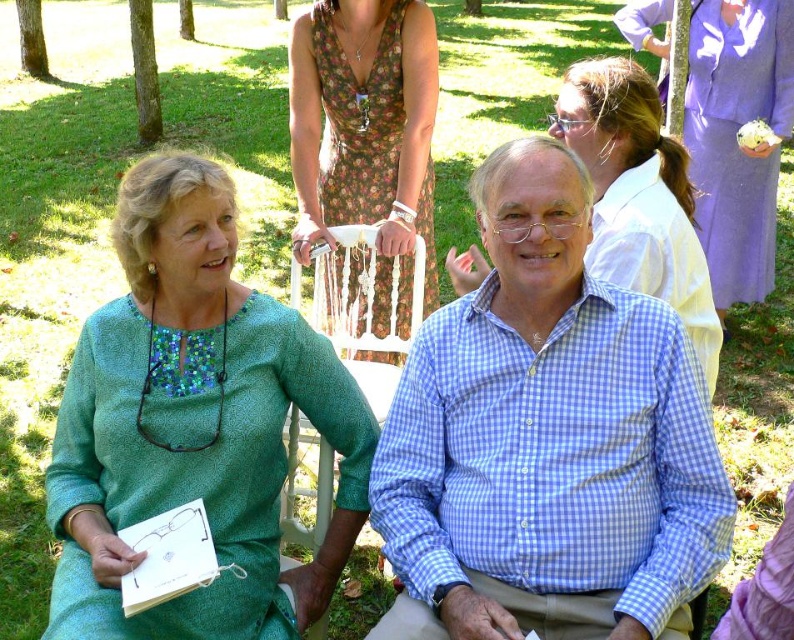
Is floral dress at center bigger than matte green dress at center?

Indeed, floral dress at center has a larger size compared to matte green dress at center.

Looking at this image, does floral dress at center lie behind matte green dress at center?

Yes, floral dress at center is further from the viewer.

Is point (384, 253) positioned after point (627, 99)?

Yes, it is behind point (627, 99).

Where is `floral dress at center`? The image size is (794, 640). floral dress at center is located at coordinates (365, 134).

Between point (444, 312) and point (87, 513), which one is positioned behind?

Point (444, 312)

Is blue checkered shirt at center to the right of green textured dress at left from the viewer's perspective?

Correct, you'll find blue checkered shirt at center to the right of green textured dress at left.

Between point (446, 568) and point (345, 472), which one is positioned in front?

Positioned in front is point (446, 568).

At what (x,y) coordinates should I click in order to perform the action: click on blue checkered shirt at center. Please return your answer as a coordinate pair (x, y). Looking at the image, I should click on (546, 435).

Does lavender satin dress at upper right appear on the left side of matte green dress at center?

In fact, lavender satin dress at upper right is to the right of matte green dress at center.

How distant is lavender satin dress at upper right from matte green dress at center?

lavender satin dress at upper right and matte green dress at center are 6.80 feet apart.

Between point (737, 172) and point (660, 196), which one is positioned in front?

Point (660, 196) is more forward.

You are a GUI agent. You are given a task and a screenshot of the screen. Output one action in this format:
    pyautogui.click(x=<x>, y=<y>)
    Task: Click on the lavender satin dress at upper right
    
    Given the screenshot: What is the action you would take?
    pyautogui.click(x=735, y=134)